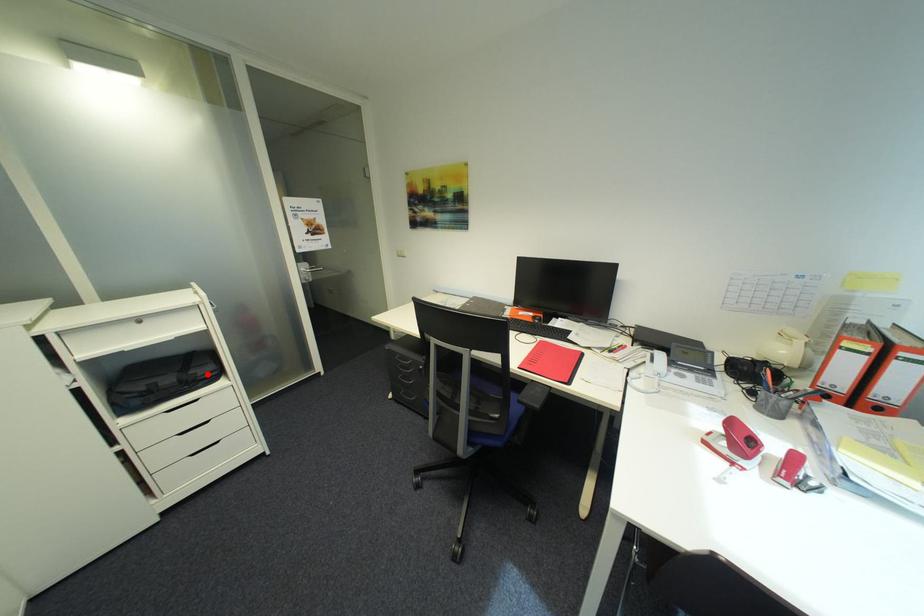
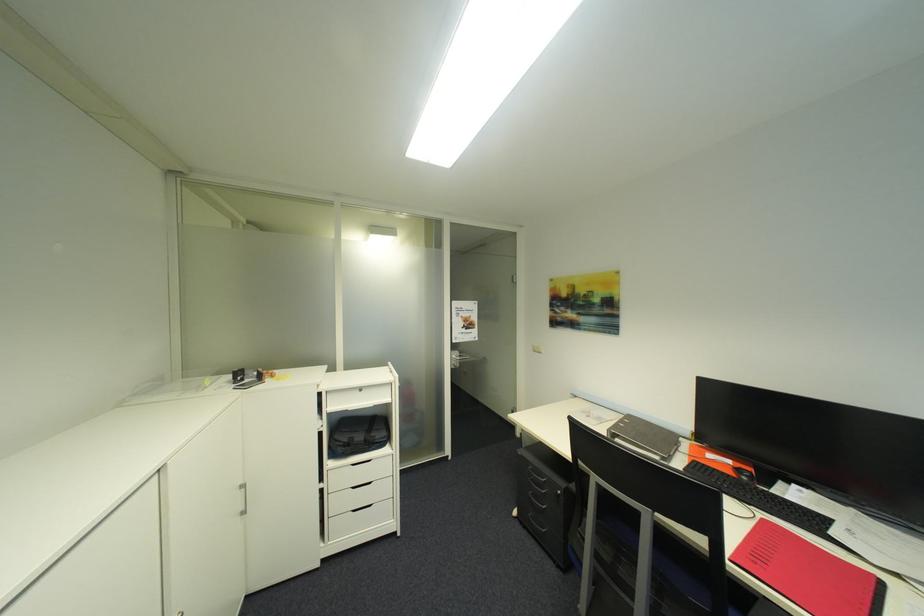
Question: I am providing you with two images of the same scene from different viewpoints. A red point is shown in image1. For the corresponding object point in image2, is it positioned nearer or farther from the camera?

Choices:
 (A) Nearer
 (B) Farther

Answer: (B)